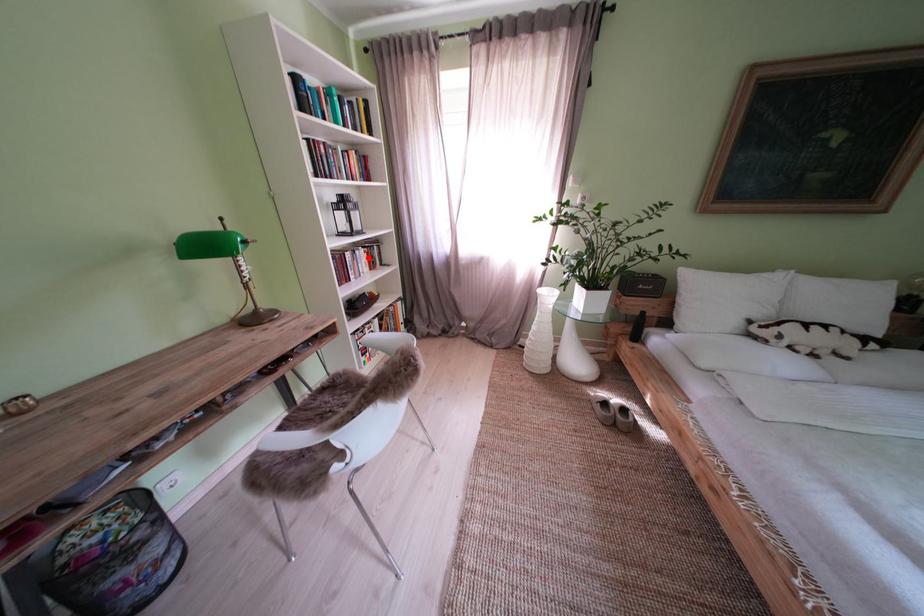
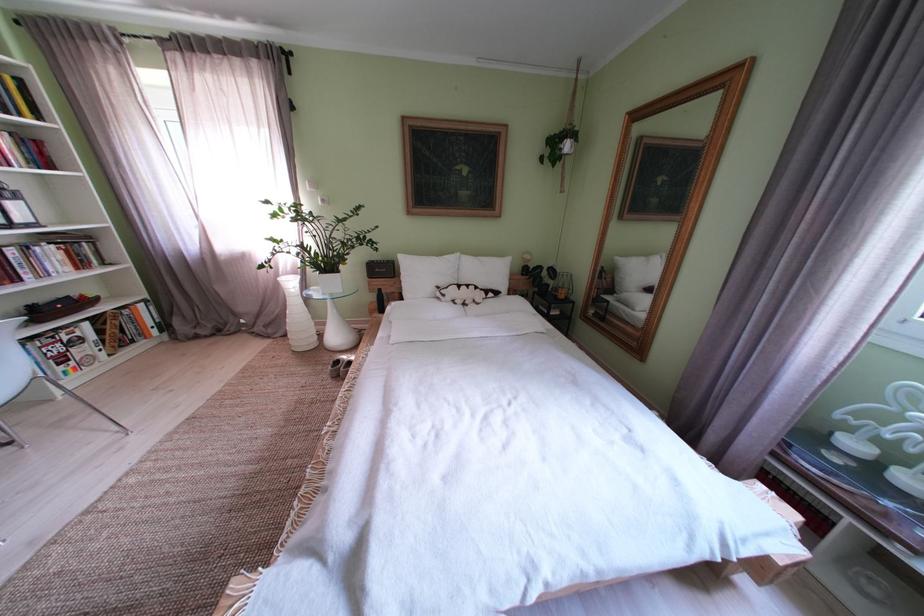
In the second image, find the point that corresponds to the highlighted location in the first image.

(49, 254)